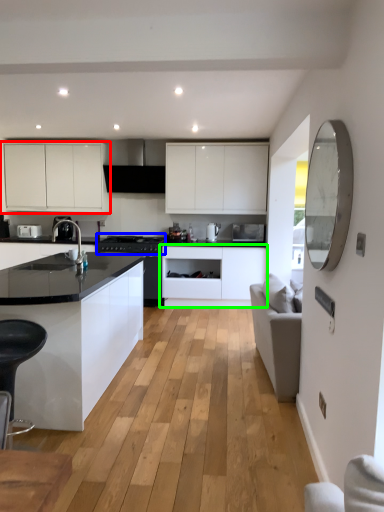
Question: Which is farther away from cabinetry (highlighted by a red box)? appliance (highlighted by a blue box) or cabinetry (highlighted by a green box)?

Choices:
 (A) appliance
 (B) cabinetry

Answer: (B)